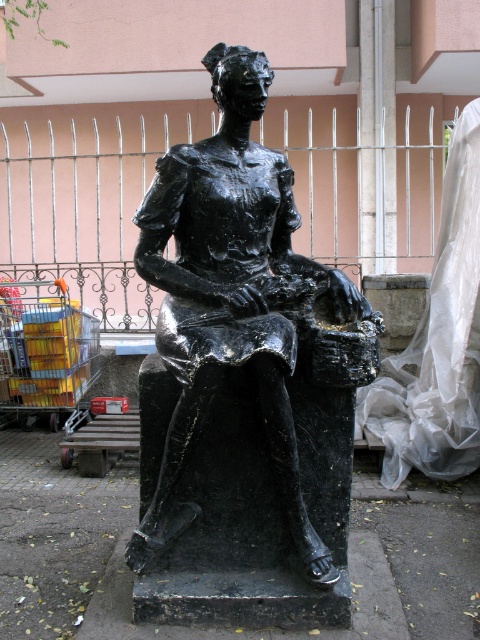
You are standing in front of the black polished statue at center. If you walk directly towards the statue, will you first encounter the metal fence or the pinkish wall behind it?

The black polished statue at center is located at point (240, 305). Since the statue is at the center, the metal fence is in front of the statue, so you would first encounter the metal fence before reaching the pinkish wall behind it.

You are a photographer setting up a tripod to capture the black polished statue at center and the metallic yellow cart at lower left. You need to ensure both are in frame. Given the statue is taller than the cart, which object should you adjust your camera angle to focus on first to include both in the shot?

The black polished statue at center is taller than the metallic yellow cart at lower left, so you should adjust your camera angle to focus on the black polished statue at center first to ensure it fits within the frame before adjusting for the cart.